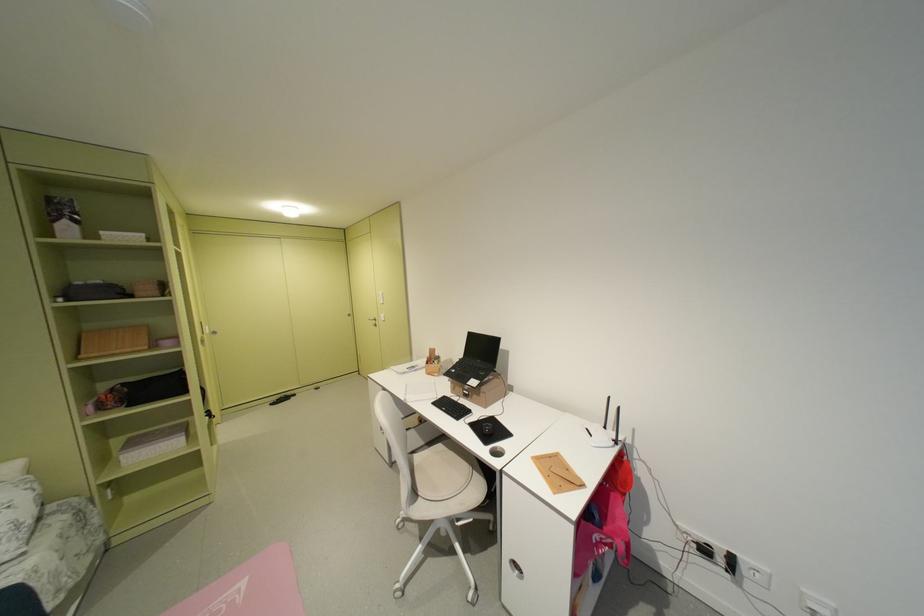
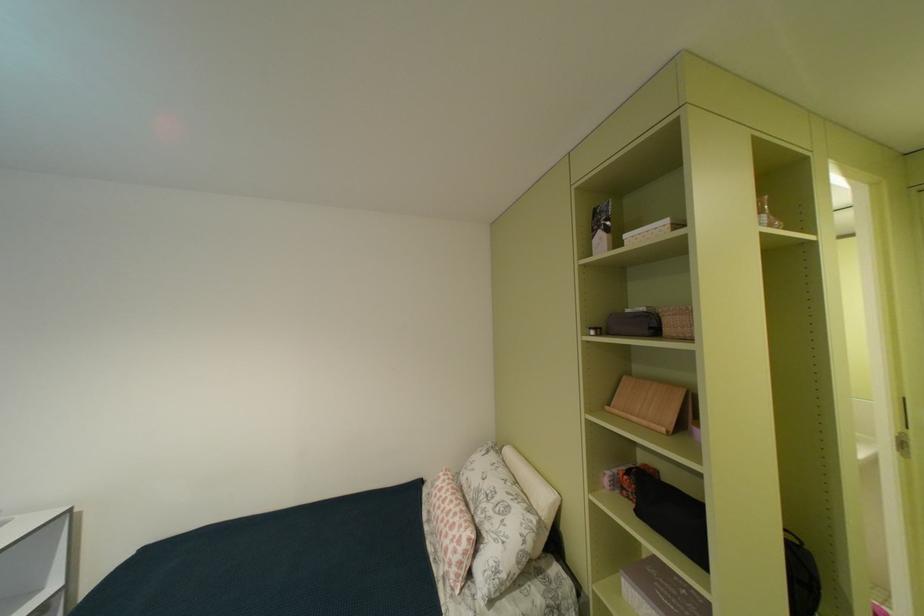
Find the pixel in the second image that matches point 147,294 in the first image.

(675, 331)